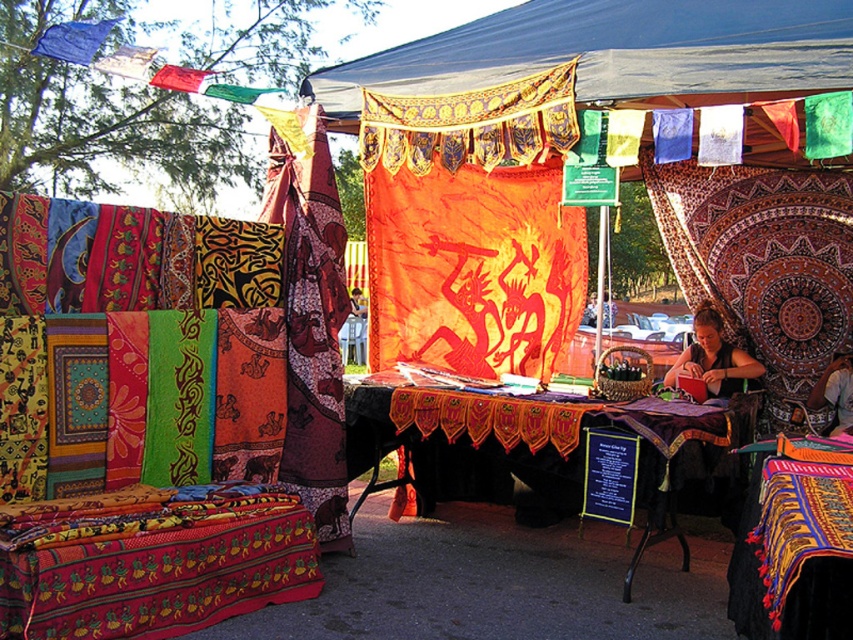
You are standing at the entrance of the market stall and want to reach both the point at coordinates point (640, 428) and the point at coordinates point (792, 588). Which point will you encounter first as you walk towards them?

You will encounter the point at coordinates point (640, 428) first because it is closer to you than the point at coordinates point (792, 588), which is further away.

You are a vendor at the market and need to place a new item that requires 1 meter of space between the matte black table at center and the multicolored woven cloth at center. Can you fit it there?

The distance between the matte black table at center and the multicolored woven cloth at center is 1.19 meters, which is more than enough to accommodate the new item requiring 1 meter of space.

You are a customer at the market and want to hang a new decoration under the orange fabric canopy at center. The vibrant woven quilt at lower left is currently placed there. Can you determine if the canopy is tall enough to accommodate the quilt without folding it?

The orange fabric canopy at center is taller than the vibrant woven quilt at lower left, so yes, the canopy is tall enough to accommodate the quilt without needing to fold it.